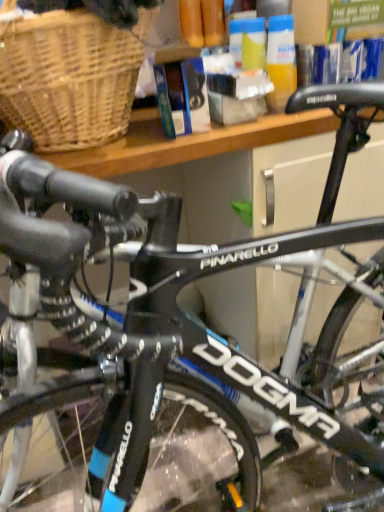
What do you see at coordinates (70, 75) in the screenshot? I see `woven wicker basket at upper left` at bounding box center [70, 75].

What are the coordinates of `woven wicker basket at upper left` in the screenshot? It's located at (70, 75).

You are a GUI agent. You are given a task and a screenshot of the screen. Output one action in this format:
    pyautogui.click(x=<x>, y=<y>)
    Task: Click on the woven wicker basket at upper left
    The width and height of the screenshot is (384, 512).
    Given the screenshot: What is the action you would take?
    pyautogui.click(x=70, y=75)